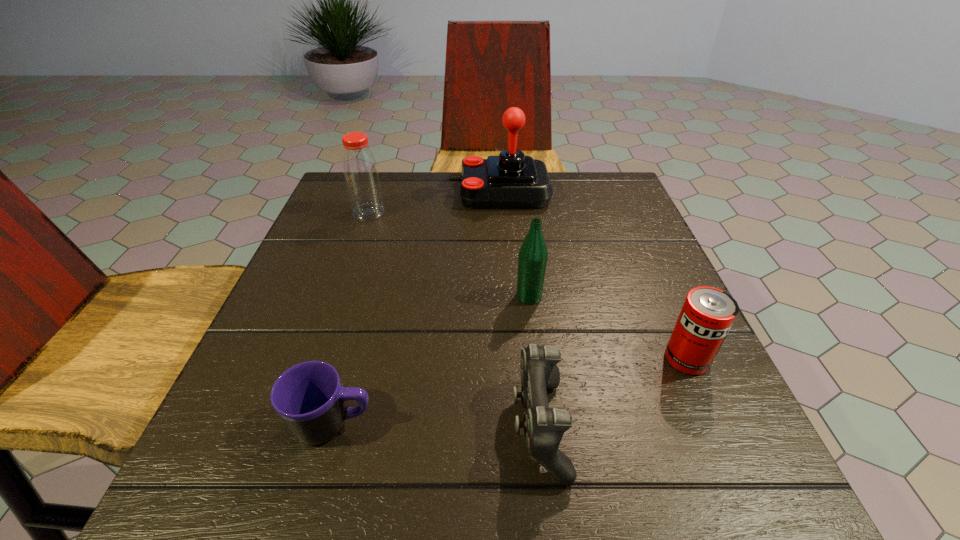
The width and height of the screenshot is (960, 540). In order to click on vacant space that's between the farther bottle and the mug in this screenshot , I will do `click(351, 319)`.

Where is `free spot between the can and the mug`? The width and height of the screenshot is (960, 540). free spot between the can and the mug is located at coordinates (510, 392).

Image resolution: width=960 pixels, height=540 pixels. I want to click on the fourth closest object relative to the right bottle, so click(309, 398).

In order to click on object that ranks as the fourth closest to the left bottle in this screenshot , I will do `click(544, 427)`.

You are a GUI agent. You are given a task and a screenshot of the screen. Output one action in this format:
    pyautogui.click(x=<x>, y=<y>)
    Task: Click on the free space that satisfies the following two spatial constraints: 1. on the base of the joystick; 2. on the front side of the farther bottle
    The height and width of the screenshot is (540, 960).
    Given the screenshot: What is the action you would take?
    pyautogui.click(x=501, y=212)

You are a GUI agent. You are given a task and a screenshot of the screen. Output one action in this format:
    pyautogui.click(x=<x>, y=<y>)
    Task: Click on the free space that satisfies the following two spatial constraints: 1. on the front side of the farther bottle; 2. on the left side of the fourth tallest object
    The width and height of the screenshot is (960, 540).
    Given the screenshot: What is the action you would take?
    pyautogui.click(x=318, y=359)